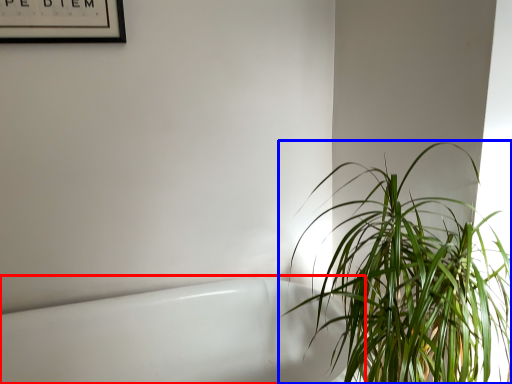
Question: Which object is further to the camera taking this photo, bath (highlighted by a red box) or houseplant (highlighted by a blue box)?

Choices:
 (A) bath
 (B) houseplant

Answer: (A)